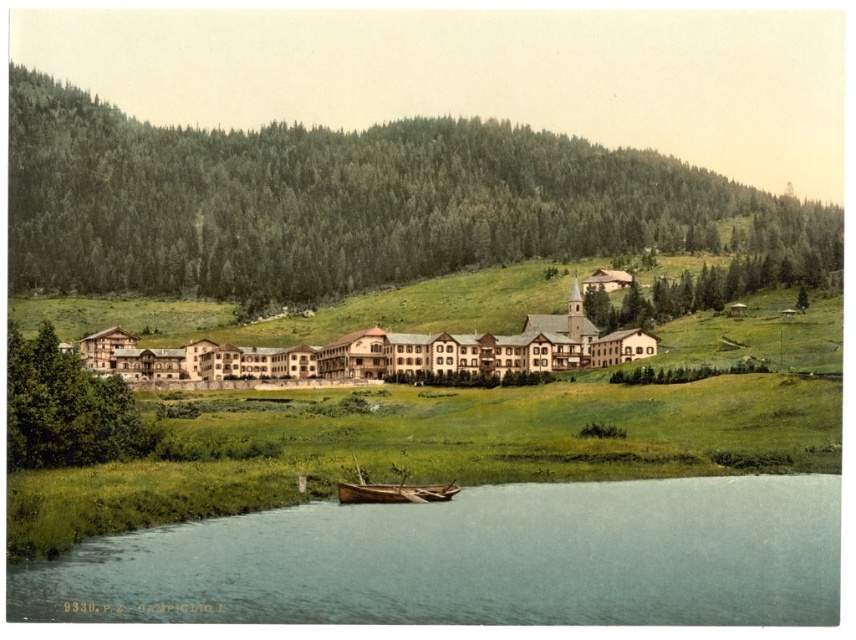
Question: Considering the real-world distances, which object is closest to the blue water at lower center?

Choices:
 (A) green textured trees at center
 (B) wooden boat at lower center
 (C) green leafy tree at left

Answer: (B)

Question: Can you confirm if beige stone hotel at center is thinner than green leafy tree at left?

Choices:
 (A) yes
 (B) no

Answer: (B)

Question: Is beige stone hotel at center smaller than green textured tree at upper right?

Choices:
 (A) no
 (B) yes

Answer: (B)

Question: Which of the following is the farthest from the observer?

Choices:
 (A) blue water at lower center
 (B) beige stone hotel at center
 (C) green textured tree at upper right
 (D) green textured trees at center

Answer: (D)

Question: Is the position of green textured trees at center less distant than that of green leafy tree at left?

Choices:
 (A) no
 (B) yes

Answer: (A)

Question: Which of the following is the farthest from the observer?

Choices:
 (A) (721, 268)
 (B) (603, 198)

Answer: (B)